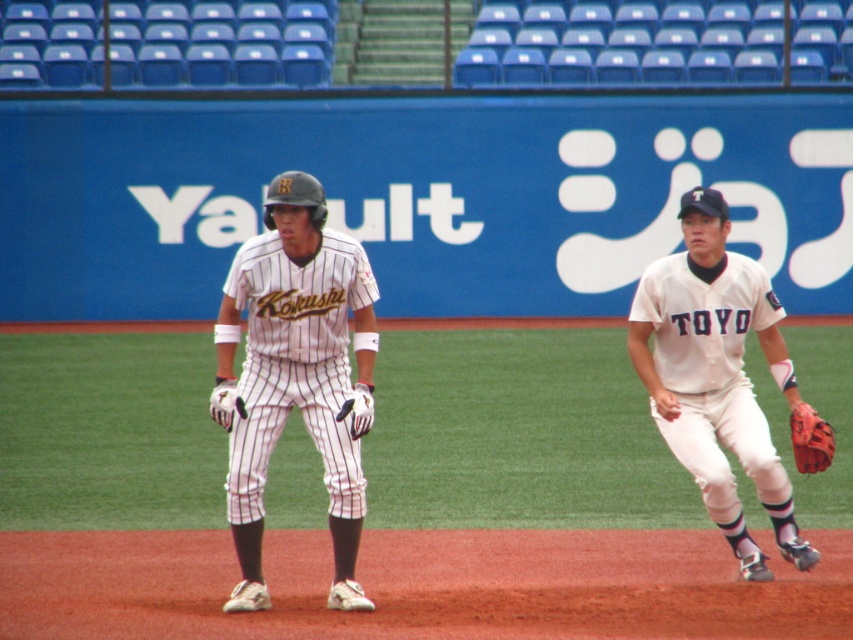
You are a baseball coach observing the game. You notice the white matte baseball uniform at right and the white leather glove at center. How far apart are these two items?

The distance between the white matte baseball uniform at right and the white leather glove at center is 2.11 meters.

You are a photographer standing at the edge of the baseball field. You want to take a photo of the white pinstriped uniform at center and the leather textured glove at right. If your camera has a maximum focus range of 6 feet, will both subjects be in focus?

The white pinstriped uniform at center is 6.63 feet away from the leather textured glove at right. Since the distance between them is 6.63 feet, which exceeds the camera maximum focus range of 6 feet, the two subjects will not be in focus simultaneously.